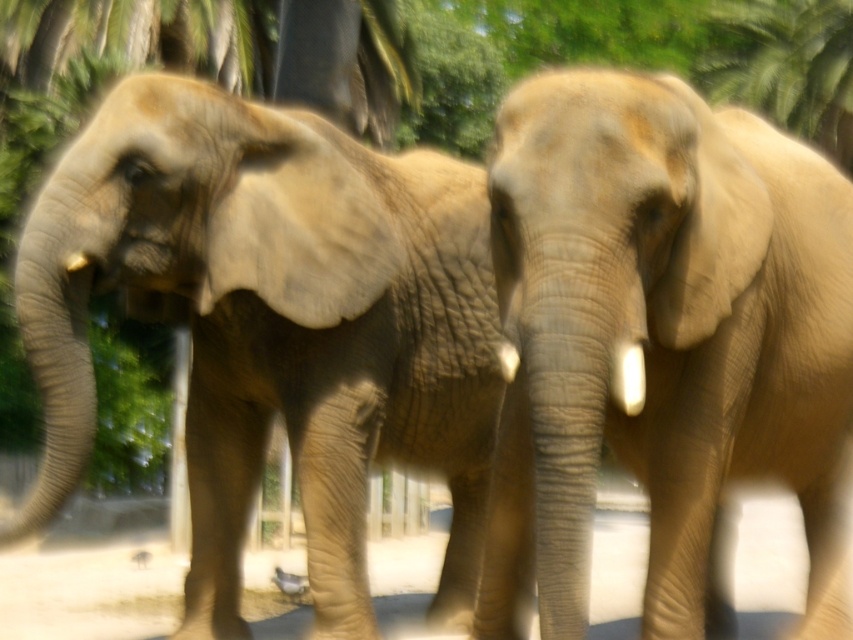
Question: Which point is closer to the camera taking this photo?

Choices:
 (A) (370, 353)
 (B) (610, 76)

Answer: (B)

Question: Which of the following is the farthest from the observer?

Choices:
 (A) (383, 486)
 (B) (490, 595)

Answer: (A)

Question: In this image, where is smooth beige elephant at center located relative to wooden fence at lower center?

Choices:
 (A) below
 (B) above

Answer: (B)

Question: Does smooth beige elephant at center appear on the left side of wooden fence at lower center?

Choices:
 (A) no
 (B) yes

Answer: (A)

Question: Can you confirm if smooth beige elephant at center is thinner than wooden fence at lower center?

Choices:
 (A) no
 (B) yes

Answer: (A)

Question: Which point is farther to the camera?

Choices:
 (A) (506, 513)
 (B) (412, 500)
 (C) (264, 376)

Answer: (B)